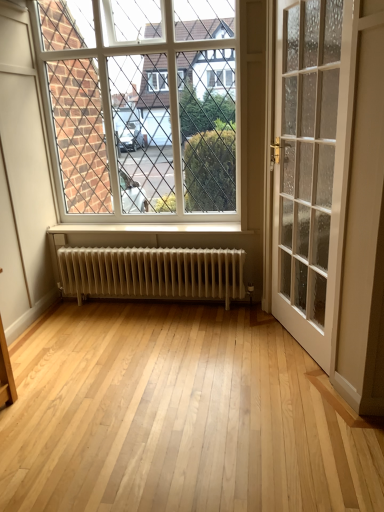
This screenshot has height=512, width=384. Find the location of `white glass window at upper center`. white glass window at upper center is located at coordinates (143, 106).

This screenshot has height=512, width=384. I want to click on white glass door at right, so click(309, 165).

From the picture: Is the surface of white glass door at right in direct contact with white metallic radiator at center?

They are not placed beside each other.

Relative to white metallic radiator at center, is white glass door at right in front or behind?

white glass door at right is positioned closer to the viewer than white metallic radiator at center.

Between point (295, 266) and point (115, 293), which one is positioned behind?

Positioned behind is point (115, 293).

Is white glass door at right at the right side of white metallic radiator at center?

Yes, white glass door at right is to the right of white metallic radiator at center.

Based on their positions, is white glass window at upper center located to the left or right of white glass door at right?

From the image, it's evident that white glass window at upper center is to the left of white glass door at right.

Consider the image. Considering the relative sizes of white glass window at upper center and white glass door at right in the image provided, is white glass window at upper center shorter than white glass door at right?

Indeed, white glass window at upper center has a lesser height compared to white glass door at right.

Is white glass window at upper center turned away from white glass door at right?

white glass window at upper center does not have its back to white glass door at right.

From a real-world perspective, is white glass window at upper center beneath white glass door at right?

No, from a real-world perspective, white glass window at upper center is not under white glass door at right.

Is white glass window at upper center oriented towards white metallic radiator at center?

No.

Is white glass window at upper center not within white metallic radiator at center?

white glass window at upper center is positioned outside white metallic radiator at center.

Is white glass window at upper center taller or shorter than white metallic radiator at center?

Clearly, white glass window at upper center is taller compared to white metallic radiator at center.

Is white glass window at upper center thinner than white metallic radiator at center?

Correct, the width of white glass window at upper center is less than that of white metallic radiator at center.

Which object is closer to the camera, white metallic radiator at center or white glass door at right?

white glass door at right is in front.

Does white metallic radiator at center appear on the right side of white glass door at right?

No.

Considering the relative sizes of white metallic radiator at center and white glass door at right in the image provided, is white metallic radiator at center shorter than white glass door at right?

Indeed, white metallic radiator at center has a lesser height compared to white glass door at right.

Which point is more forward, (168,259) or (328,114)?

The point (328,114) is in front.

Which of these two, white metallic radiator at center or white glass window at upper center, stands shorter?

With less height is white metallic radiator at center.

Who is more distant, white metallic radiator at center or white glass window at upper center?

white metallic radiator at center is further away from the camera.

In the image, is white metallic radiator at center on the left side or the right side of white glass window at upper center?

Clearly, white metallic radiator at center is on the right of white glass window at upper center in the image.

Could white glass window at upper center be considered to be inside white glass door at right?

Actually, white glass window at upper center is outside white glass door at right.

Considering the positions of points (322, 21) and (145, 133), is point (322, 21) farther from camera compared to point (145, 133)?

That is False.

From the image's perspective, is white glass door at right located beneath white glass window at upper center?

Yes, from the image's perspective, white glass door at right is beneath white glass window at upper center.

In the scene shown: Is white glass door at right smaller than white glass window at upper center?

No, white glass door at right is not smaller than white glass window at upper center.

This screenshot has height=512, width=384. Identify the location of door in front of the white metallic radiator at center. (309, 165).

Find the location of a particular element. door below the white glass window at upper center (from the image's perspective) is located at coordinates (309, 165).

Which object lies nearer to the anchor point white metallic radiator at center, white glass window at upper center or white glass door at right?

white glass window at upper center is closer to white metallic radiator at center.

Looking at the image, which one is located closer to white glass window at upper center, white glass door at right or white metallic radiator at center?

The object closer to white glass window at upper center is white metallic radiator at center.

When comparing their distances from white glass window at upper center, does white metallic radiator at center or white glass door at right seem further?

white glass door at right.

From the image, which object appears to be nearer to white metallic radiator at center, white glass door at right or white glass window at upper center?

white glass window at upper center is closer to white metallic radiator at center.

When comparing their distances from white glass door at right, does white metallic radiator at center or white glass window at upper center seem further?

Based on the image, white glass window at upper center appears to be further to white glass door at right.

Based on their spatial positions, is white glass window at upper center or white metallic radiator at center closer to white glass door at right?

white metallic radiator at center lies closer to white glass door at right than the other object.

At what (x,y) coordinates should I click in order to perform the action: click on window between white glass door at right and white metallic radiator at center along the z-axis. Please return your answer as a coordinate pair (x, y). The height and width of the screenshot is (512, 384). Looking at the image, I should click on (143, 106).